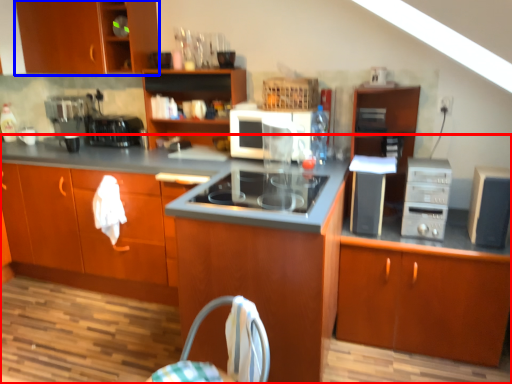
Question: Which object is further to the camera taking this photo, cabinetry (highlighted by a red box) or cabinetry (highlighted by a blue box)?

Choices:
 (A) cabinetry
 (B) cabinetry

Answer: (B)